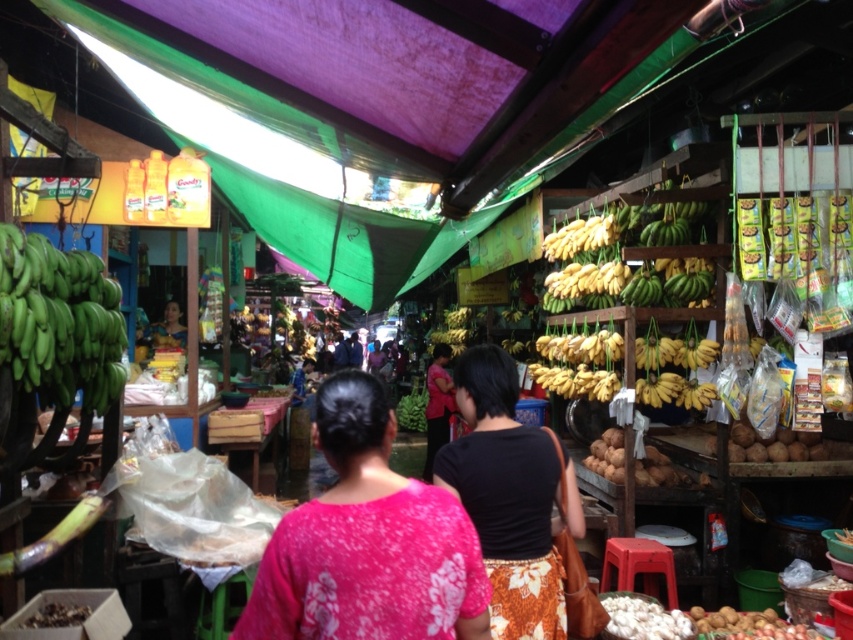
Is yellow matte bananas at upper center smaller than matte black hair at center?

Yes, yellow matte bananas at upper center is smaller than matte black hair at center.

Is point (606, 240) farther from viewer compared to point (155, 330)?

No, it is in front of (155, 330).

What do you see at coordinates (579, 236) in the screenshot?
I see `yellow matte bananas at upper center` at bounding box center [579, 236].

At what (x,y) coordinates should I click in order to perform the action: click on yellow matte bananas at upper center. Please return your answer as a coordinate pair (x, y). Looking at the image, I should click on (579, 236).

Which is behind, point (47, 384) or point (428, 465)?

Positioned behind is point (428, 465).

Does green matte bananas at left have a greater height compared to pink fabric shirt at center?

Incorrect, green matte bananas at left's height is not larger of pink fabric shirt at center's.

Does point (16, 273) come in front of point (450, 387)?

Yes.

Where is `green matte bananas at left`? This screenshot has height=640, width=853. green matte bananas at left is located at coordinates (59, 321).

Between pink fabric shirt at center and matte black hair at center, which one is positioned lower?

pink fabric shirt at center is below.

Who is more distant from viewer, (440, 358) or (167, 314)?

Positioned behind is point (440, 358).

Which is in front, point (439, 388) or point (157, 324)?

Point (157, 324) is more forward.

Where is `pink fabric shirt at center`? The width and height of the screenshot is (853, 640). pink fabric shirt at center is located at coordinates (437, 404).